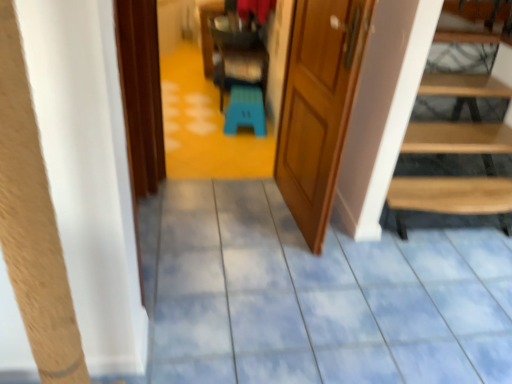
Identify the location of free space that is to the left of wooden door at center. (219, 216).